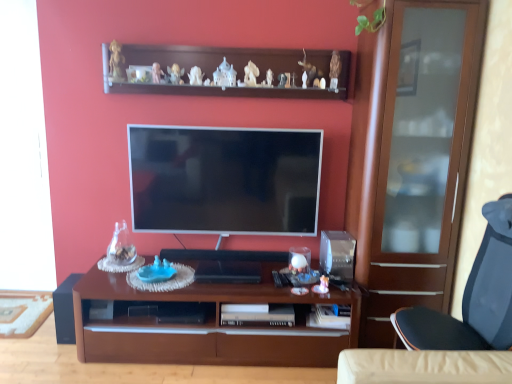
Where is `wooden desk at center`? wooden desk at center is located at coordinates (206, 325).

The height and width of the screenshot is (384, 512). Describe the element at coordinates (411, 155) in the screenshot. I see `matte brown cabinet at right` at that location.

Image resolution: width=512 pixels, height=384 pixels. I want to click on black matte speaker at lower left, so click(x=65, y=310).

What do you see at coordinates (224, 180) in the screenshot?
I see `white glossy television at center` at bounding box center [224, 180].

The height and width of the screenshot is (384, 512). What do you see at coordinates (472, 297) in the screenshot? I see `black mesh chair at right` at bounding box center [472, 297].

At what (x,y) coordinates should I click in order to perform the action: click on wooden desk at center. Please return your answer as a coordinate pair (x, y). Looking at the image, I should click on (206, 325).

How different are the orientations of matte brown cabinet at right and wooden shelf at upper center in degrees?

They differ by 3.96e-05 degrees in their facing directions.

Are matte brown cabinet at right and wooden shelf at upper center far apart?

No, matte brown cabinet at right is in close proximity to wooden shelf at upper center.

Does matte brown cabinet at right appear on the right side of wooden shelf at upper center?

Correct, you'll find matte brown cabinet at right to the right of wooden shelf at upper center.

Which point is more distant from viewer, (405,174) or (334,72)?

The point (334,72) is behind.

From the image's perspective, would you say wooden desk at center is positioned over matte brown cabinet at right?

No, from the image's perspective, wooden desk at center is not over matte brown cabinet at right.

Is wooden desk at center not close to matte brown cabinet at right?

No, wooden desk at center is not far from matte brown cabinet at right.

Based on the photo, is wooden desk at center looking in the opposite direction of matte brown cabinet at right?

That's not correct — wooden desk at center is not looking away from matte brown cabinet at right.

Which is more to the right, wooden desk at center or matte brown cabinet at right?

Positioned to the right is matte brown cabinet at right.

Does point (292, 205) come farther from viewer compared to point (62, 317)?

Yes, it is.

At what (x,y) coordinates should I click in order to perform the action: click on speaker in front of the white glossy television at center. Please return your answer as a coordinate pair (x, y). This screenshot has width=512, height=384. Looking at the image, I should click on (65, 310).

Which is more to the right, white glossy television at center or black matte speaker at lower left?

white glossy television at center is more to the right.

Between black matte speaker at lower left and black mesh chair at right, which one has more height?

black mesh chair at right.

From a real-world perspective, which is physically below, black matte speaker at lower left or black mesh chair at right?

In real-world perspective, black matte speaker at lower left is lower.

Is black matte speaker at lower left directly adjacent to black mesh chair at right?

No, black matte speaker at lower left is not with black mesh chair at right.

From the picture: Is black mesh chair at right at the back of black matte speaker at lower left?

No, black matte speaker at lower left is not facing the opposite direction of black mesh chair at right.

Does black mesh chair at right have a larger size compared to wooden shelf at upper center?

Indeed, black mesh chair at right has a larger size compared to wooden shelf at upper center.

Considering the relative positions of black mesh chair at right and wooden shelf at upper center in the image provided, is black mesh chair at right to the right of wooden shelf at upper center from the viewer's perspective?

Indeed, black mesh chair at right is positioned on the right side of wooden shelf at upper center.

Is black mesh chair at right taller or shorter than wooden shelf at upper center?

Considering their sizes, black mesh chair at right has more height than wooden shelf at upper center.

Considering the positions of point (490, 319) and point (125, 91), is point (490, 319) closer or farther from the camera than point (125, 91)?

Clearly, point (490, 319) is closer to the camera than point (125, 91).

Which point is more distant from viewer, [254,74] or [408,318]?

Point [254,74]

Can you confirm if wooden shelf at upper center is bigger than black mesh chair at right?

No, wooden shelf at upper center is not bigger than black mesh chair at right.

From the image's perspective, would you say black mesh chair at right is shown under black matte speaker at lower left?

Actually, black mesh chair at right appears above black matte speaker at lower left in the image.

Which object is further away from the camera, black mesh chair at right or black matte speaker at lower left?

black matte speaker at lower left is further from the camera.

Consider the image. Would you say black mesh chair at right contains black matte speaker at lower left?

Actually, black matte speaker at lower left is outside black mesh chair at right.

Is black mesh chair at right oriented towards black matte speaker at lower left?

Yes, black mesh chair at right is aimed at black matte speaker at lower left.

The height and width of the screenshot is (384, 512). I want to click on shelf that appears above the matte brown cabinet at right (from a real-world perspective), so click(x=223, y=71).

Identify the location of cabinetry on the right of wooden desk at center. (411, 155).

Which object lies further to the anchor point white glossy television at center, wooden desk at center or black matte speaker at lower left?

black matte speaker at lower left.

Looking at this image, from the image, which object appears to be nearer to black mesh chair at right, black matte speaker at lower left or wooden shelf at upper center?

Among the two, wooden shelf at upper center is located nearer to black mesh chair at right.

When comparing their distances from wooden shelf at upper center, does wooden desk at center or white glossy television at center seem further?

wooden desk at center is positioned further to the anchor wooden shelf at upper center.

Which object lies further to the anchor point wooden shelf at upper center, blue plastic toy at center or black matte speaker at lower left?

Among the two, black matte speaker at lower left is located further to wooden shelf at upper center.

From the picture: Based on their spatial positions, is white glossy television at center or wooden shelf at upper center closer to black mesh chair at right?

The object closer to black mesh chair at right is white glossy television at center.

Looking at the image, which one is located closer to black matte speaker at lower left, wooden desk at center or matte brown cabinet at right?

Based on the image, wooden desk at center appears to be nearer to black matte speaker at lower left.

Considering their positions, is wooden desk at center positioned further to black mesh chair at right than blue plastic toy at center?

Among the two, blue plastic toy at center is located further to black mesh chair at right.

Consider the image. Looking at the image, which one is located closer to white glossy television at center, black mesh chair at right or blue plastic toy at center?

blue plastic toy at center is positioned closer to the anchor white glossy television at center.

Image resolution: width=512 pixels, height=384 pixels. Find the location of `television between blue plastic toy at center and black mesh chair at right`. television between blue plastic toy at center and black mesh chair at right is located at coordinates (224, 180).

Image resolution: width=512 pixels, height=384 pixels. I want to click on toy between white glossy television at center and wooden desk at center in the vertical direction, so click(157, 271).

The width and height of the screenshot is (512, 384). I want to click on cabinetry between blue plastic toy at center and black mesh chair at right in the horizontal direction, so click(x=411, y=155).

I want to click on toy between black matte speaker at lower left and black mesh chair at right, so click(157, 271).